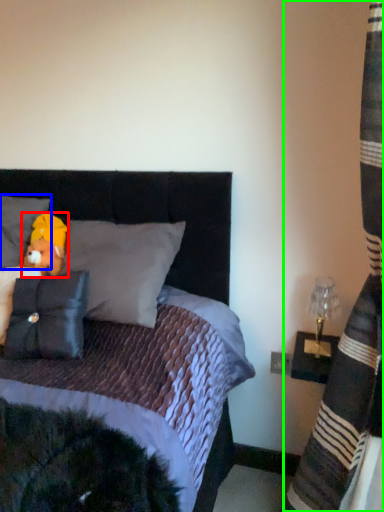
Question: Considering the real-world distances, which object is farthest from figurine (highlighted by a red box)? pillow (highlighted by a blue box) or curtain (highlighted by a green box)?

Choices:
 (A) pillow
 (B) curtain

Answer: (B)